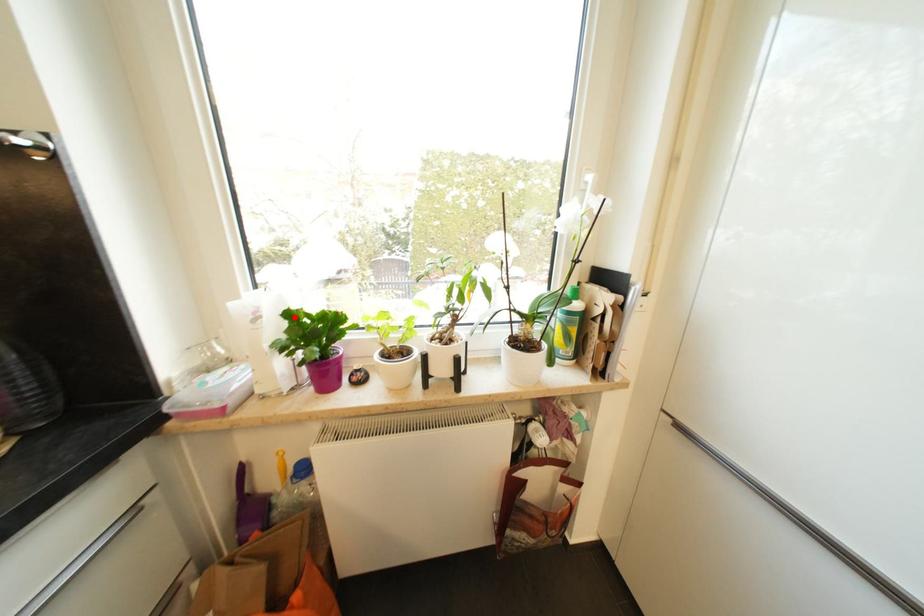
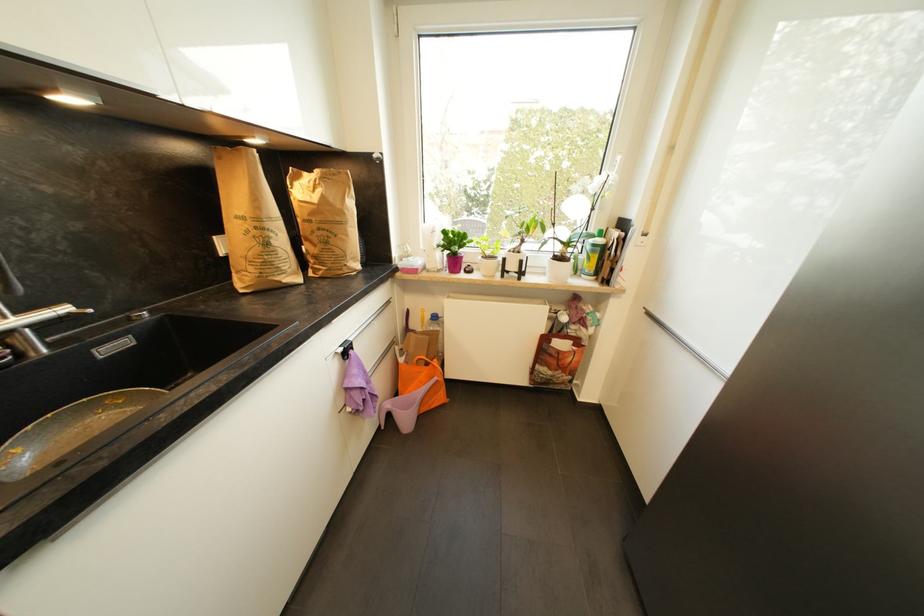
Locate, in the second image, the point that corresponds to the highlighted location in the first image.

(450, 233)